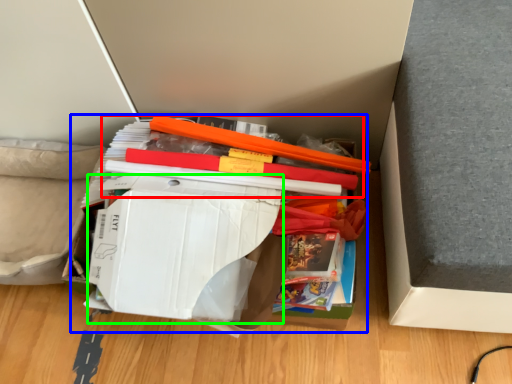
Question: Which object is the closest to the book (highlighted by a red box)? Choose among these: paperback book (highlighted by a blue box) or paperback book (highlighted by a green box).

Choices:
 (A) paperback book
 (B) paperback book

Answer: (A)